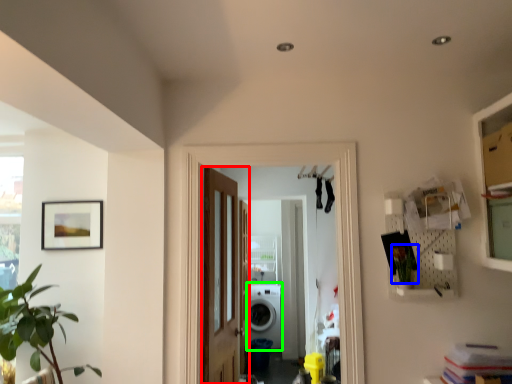
Question: Which is farther away from door (highlighted by a red box)? plant (highlighted by a blue box) or washing machine (highlighted by a green box)?

Choices:
 (A) plant
 (B) washing machine

Answer: (B)